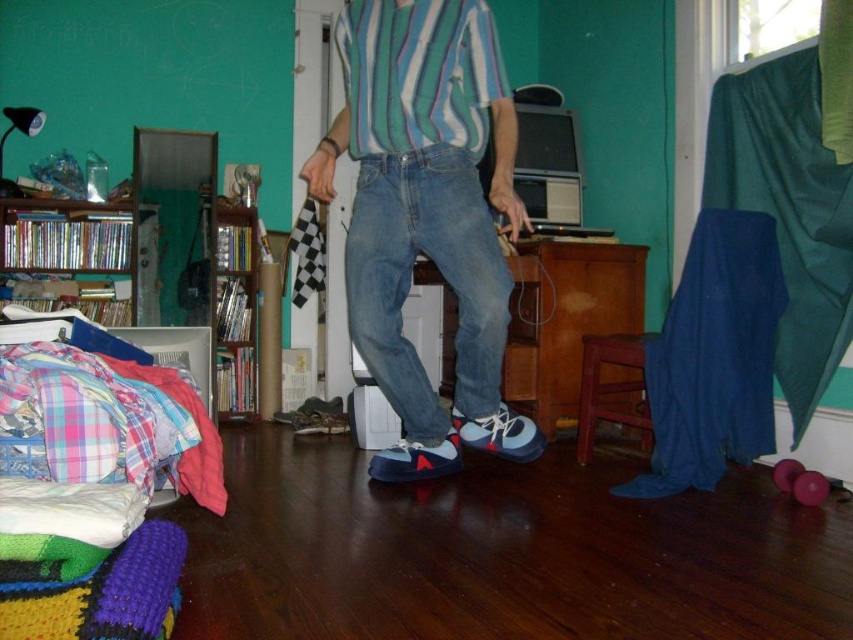
Question: Does matte blue sneakers at center appear under wooden bookshelf at left?

Choices:
 (A) yes
 (B) no

Answer: (B)

Question: Which point is closer to the camera?

Choices:
 (A) (231, 381)
 (B) (341, 122)

Answer: (B)

Question: Which of the following is the farthest from the observer?

Choices:
 (A) matte blue sneakers at center
 (B) wooden bookshelf at left

Answer: (B)

Question: Does matte blue sneakers at center have a lesser width compared to wooden bookshelf at left?

Choices:
 (A) no
 (B) yes

Answer: (A)

Question: Does matte blue sneakers at center have a larger size compared to wooden bookshelf at left?

Choices:
 (A) yes
 (B) no

Answer: (A)

Question: Which object appears farthest from the camera in this image?

Choices:
 (A) matte blue sneakers at center
 (B) wooden bookshelf at left

Answer: (B)